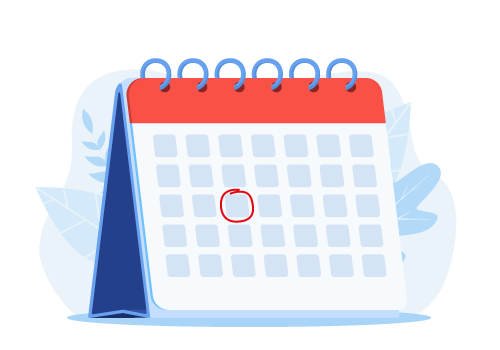
Locate an element on the screen. This screenshot has width=500, height=350. spirals binding the calendar together is located at coordinates (155, 58), (185, 60), (235, 60), (266, 60), (305, 58), (341, 58).